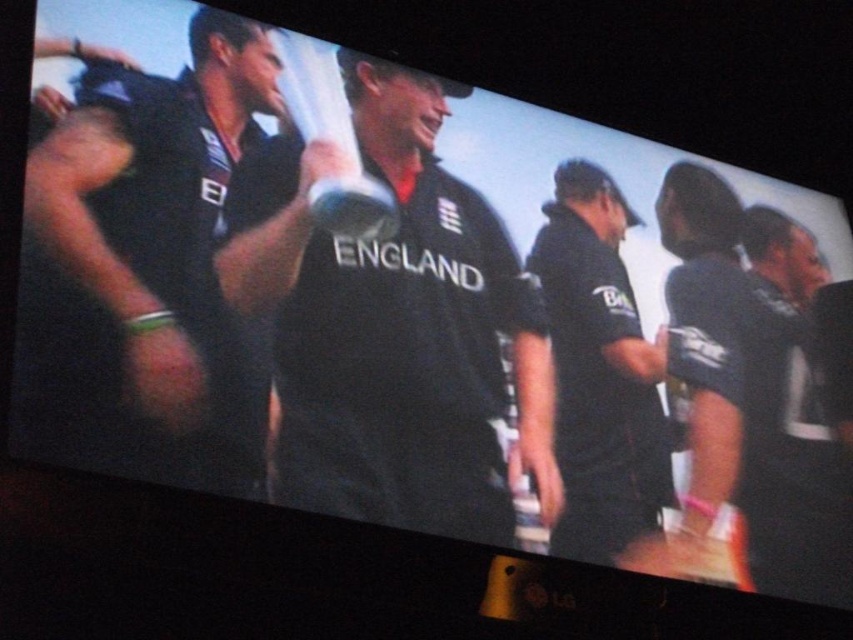
Question: Which object appears closest to the camera in this image?

Choices:
 (A) matte black shirt at left
 (B) black matte shirt at right
 (C) black matte shirt at center

Answer: (A)

Question: Does black matte shirt at center have a greater width compared to black matte shirt at right?

Choices:
 (A) yes
 (B) no

Answer: (A)

Question: Which of the following is the farthest from the observer?

Choices:
 (A) matte black shirt at left
 (B) black matte shirt at center
 (C) black matte shirt at right

Answer: (C)

Question: Does matte black shirt at left lie behind black matte shirt at right?

Choices:
 (A) yes
 (B) no

Answer: (B)

Question: In this image, where is black matte shirt at center located relative to matte black shirt at left?

Choices:
 (A) left
 (B) right

Answer: (B)

Question: Which point appears farthest from the camera in this image?

Choices:
 (A) (614, 209)
 (B) (544, 384)
 (C) (259, 413)

Answer: (A)